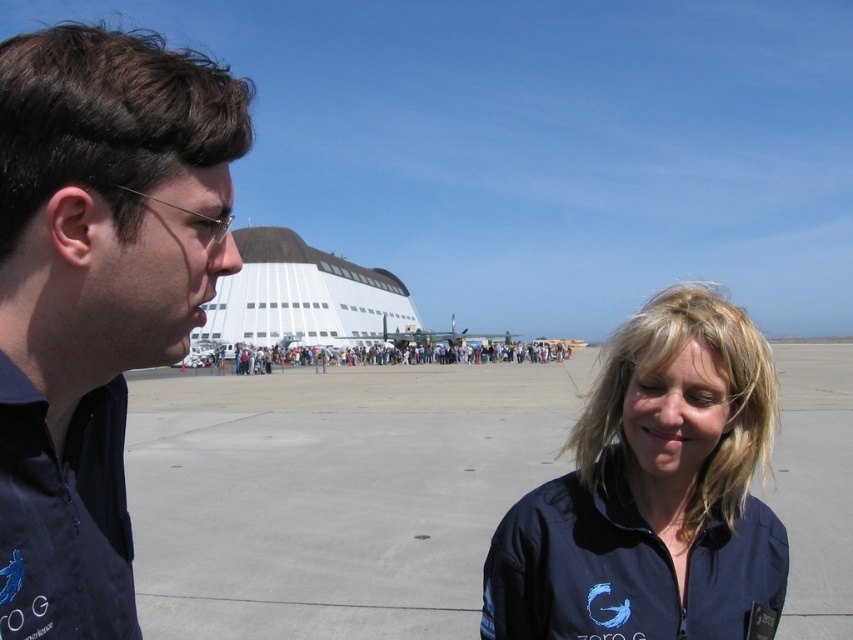
Question: Does dark blue fabric at left appear under dark blue fabric couple at center?

Choices:
 (A) no
 (B) yes

Answer: (A)

Question: Which point is farther from the camera taking this photo?

Choices:
 (A) (465, 620)
 (B) (637, 340)

Answer: (A)

Question: Is dark blue fabric at left further to camera compared to dark blue fabric couple at center?

Choices:
 (A) no
 (B) yes

Answer: (A)

Question: Among these points, which one is farthest from the camera?

Choices:
 (A) click(830, 609)
 (B) click(766, 529)

Answer: (A)

Question: Among these objects, which one is nearest to the camera?

Choices:
 (A) dark gray asphalt at center
 (B) dark blue fabric at left
 (C) dark blue fabric couple at center
 (D) blue fabric jacket at center

Answer: (B)

Question: Can you confirm if dark gray asphalt at center is positioned above dark blue fabric couple at center?

Choices:
 (A) yes
 (B) no

Answer: (B)